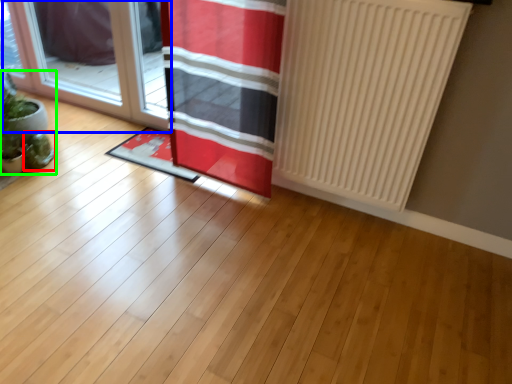
Question: Which is nearer to the plant (highlighted by a red box)? door (highlighted by a blue box) or houseplant (highlighted by a green box).

Choices:
 (A) door
 (B) houseplant

Answer: (B)